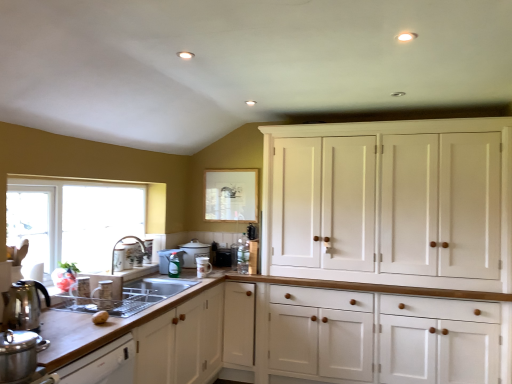
Identify the location of free space in front of satin silver sink at lower left. Image resolution: width=512 pixels, height=384 pixels. (76, 317).